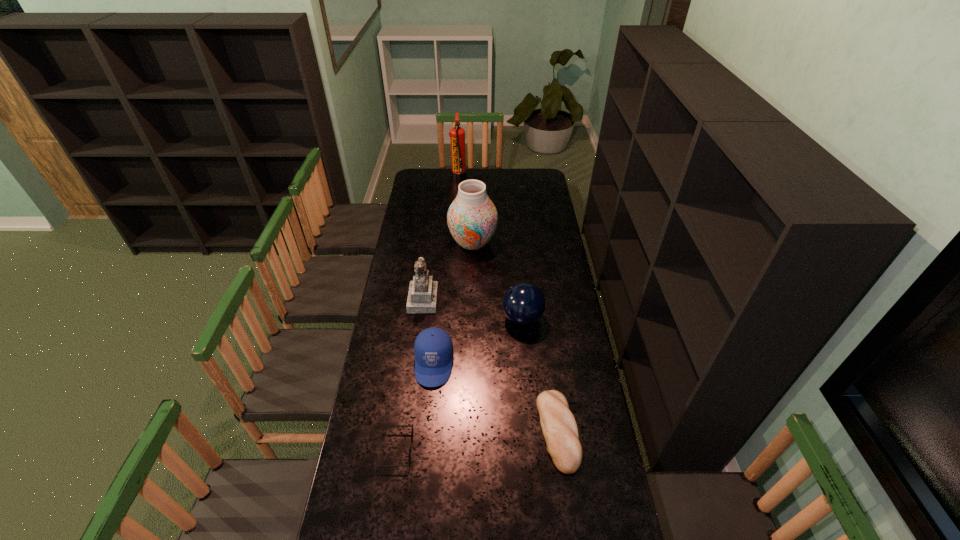
The width and height of the screenshot is (960, 540). I want to click on vacant region between the bowling ball and the third shortest object, so point(478,341).

Identify which object is the sixth nearest to the figurine. Please provide its 2D coordinates. Your answer should be formatted as a tuple, i.e. [(x, y)], where the tuple contains the x and y coordinates of a point satisfying the conditions above.

[(457, 134)]

Select which object is the sixth closest to the fire extinguisher. Please provide its 2D coordinates. Your answer should be formatted as a tuple, i.e. [(x, y)], where the tuple contains the x and y coordinates of a point satisfying the conditions above.

[(393, 425)]

The width and height of the screenshot is (960, 540). In order to click on vacant area that satisfies the following two spatial constraints: 1. with the nozzle pointing from the back of the farthest object; 2. on the right side of the vase in this screenshot , I will do `click(454, 243)`.

You are a GUI agent. You are given a task and a screenshot of the screen. Output one action in this format:
    pyautogui.click(x=<x>, y=<y>)
    Task: Click on the vacant point that satisfies the following two spatial constraints: 1. on the back side of the vase; 2. with the nozzle pointing from the back of the fire extinguisher
    This screenshot has height=540, width=960.
    Given the screenshot: What is the action you would take?
    pyautogui.click(x=474, y=176)

The height and width of the screenshot is (540, 960). Identify the location of free space that satisfies the following two spatial constraints: 1. on the front-facing side of the fifth shortest object; 2. on the left side of the bread. (405, 431).